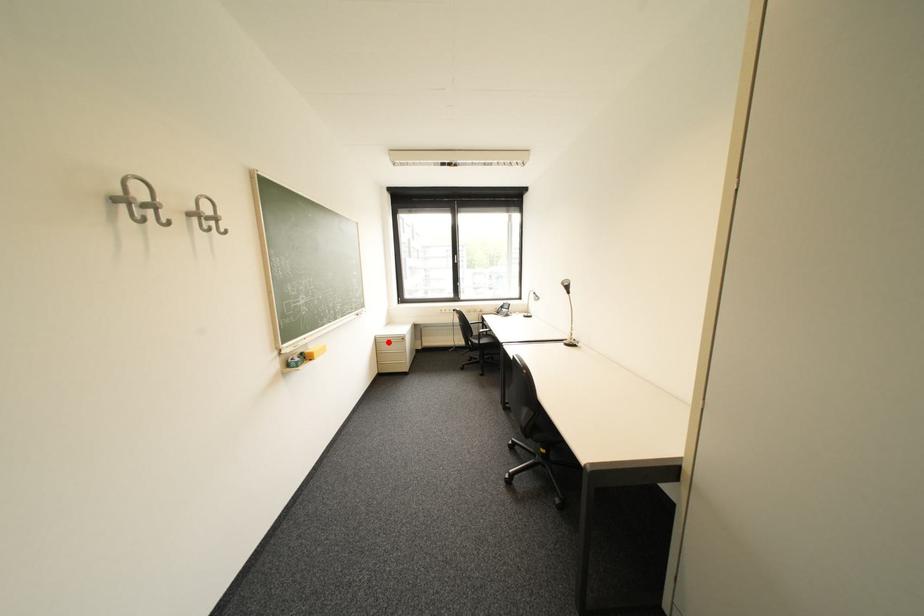
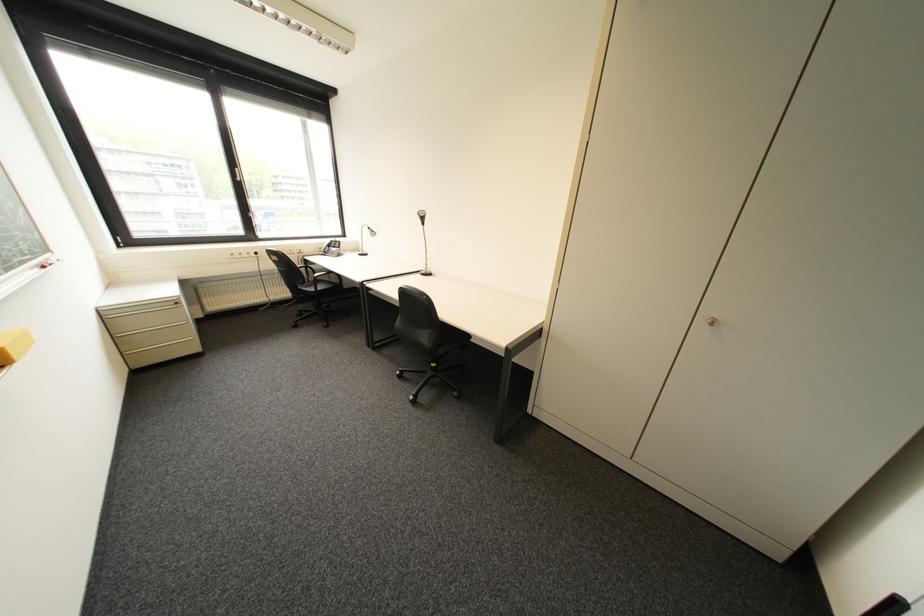
Question: I am providing you with two images of the same scene from different viewpoints. In image1, a red point is highlighted. Considering the same 3D point in image2, which of the following is correct?

Choices:
 (A) It is closer
 (B) It is farther

Answer: (A)